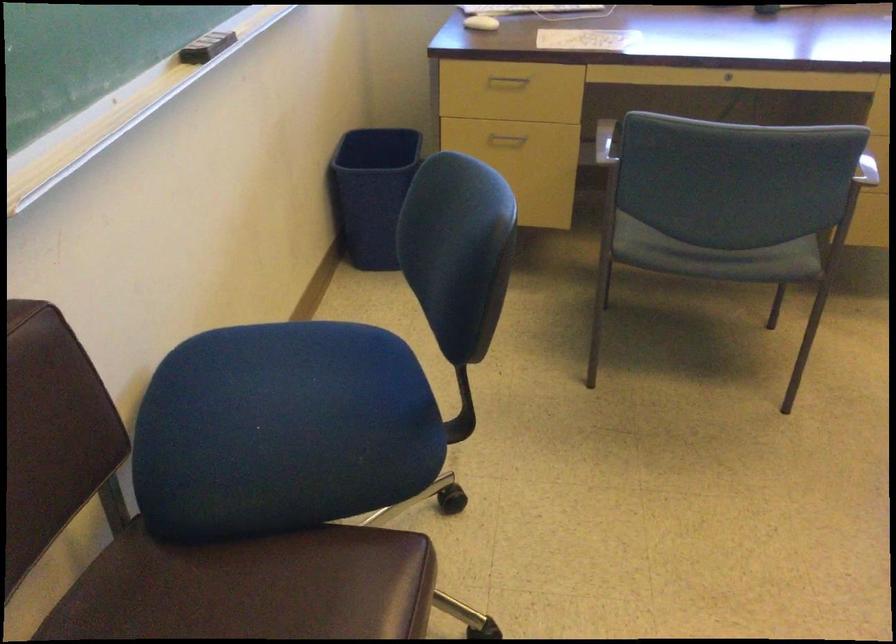
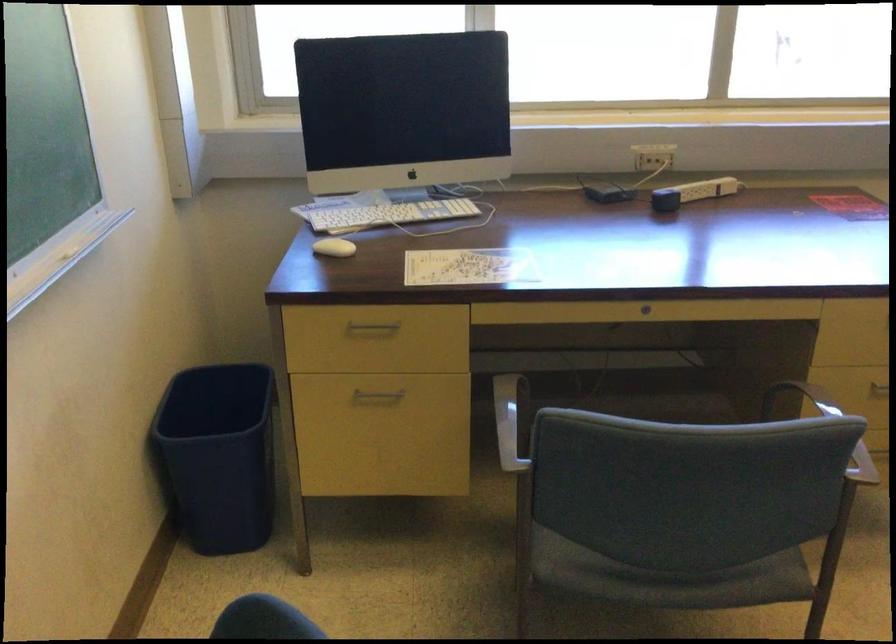
Where in the second image is the point corresponding to (504,138) from the first image?

(376, 395)